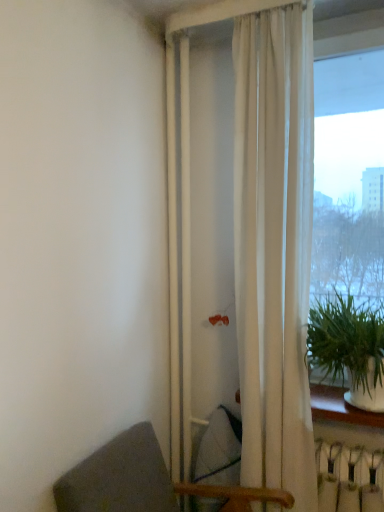
Question: Would you consider dark gray fabric chair at lower left to be distant from green leafy plant at right?

Choices:
 (A) yes
 (B) no

Answer: (B)

Question: Considering the relative sizes of dark gray fabric chair at lower left and green leafy plant at right in the image provided, is dark gray fabric chair at lower left smaller than green leafy plant at right?

Choices:
 (A) no
 (B) yes

Answer: (A)

Question: Is dark gray fabric chair at lower left closer to the viewer compared to green leafy plant at right?

Choices:
 (A) no
 (B) yes

Answer: (B)

Question: Is dark gray fabric chair at lower left behind green leafy plant at right?

Choices:
 (A) yes
 (B) no

Answer: (B)

Question: Is dark gray fabric chair at lower left oriented away from green leafy plant at right?

Choices:
 (A) no
 (B) yes

Answer: (A)

Question: Is dark gray fabric chair at lower left in front of or behind transparent glass window at right in the image?

Choices:
 (A) behind
 (B) front

Answer: (B)

Question: Is dark gray fabric chair at lower left situated inside transparent glass window at right or outside?

Choices:
 (A) inside
 (B) outside

Answer: (B)

Question: Is dark gray fabric chair at lower left bigger or smaller than transparent glass window at right?

Choices:
 (A) small
 (B) big

Answer: (B)

Question: Considering the positions of dark gray fabric chair at lower left and transparent glass window at right in the image, is dark gray fabric chair at lower left taller or shorter than transparent glass window at right?

Choices:
 (A) short
 (B) tall

Answer: (A)

Question: From a real-world perspective, is white plastic radiator at lower right physically located above or below green leafy plant at right?

Choices:
 (A) above
 (B) below

Answer: (B)

Question: Is point (326, 445) closer or farther from the camera than point (339, 328)?

Choices:
 (A) farther
 (B) closer

Answer: (A)

Question: Is white plastic radiator at lower right to the left or to the right of green leafy plant at right in the image?

Choices:
 (A) right
 (B) left

Answer: (A)

Question: In the image, is white plastic radiator at lower right positioned in front of or behind green leafy plant at right?

Choices:
 (A) front
 (B) behind

Answer: (B)

Question: Does point (362, 142) appear closer or farther from the camera than point (139, 504)?

Choices:
 (A) farther
 (B) closer

Answer: (A)

Question: Considering the relative positions of transparent glass window at right and dark gray fabric chair at lower left in the image provided, is transparent glass window at right to the left or to the right of dark gray fabric chair at lower left?

Choices:
 (A) right
 (B) left

Answer: (A)